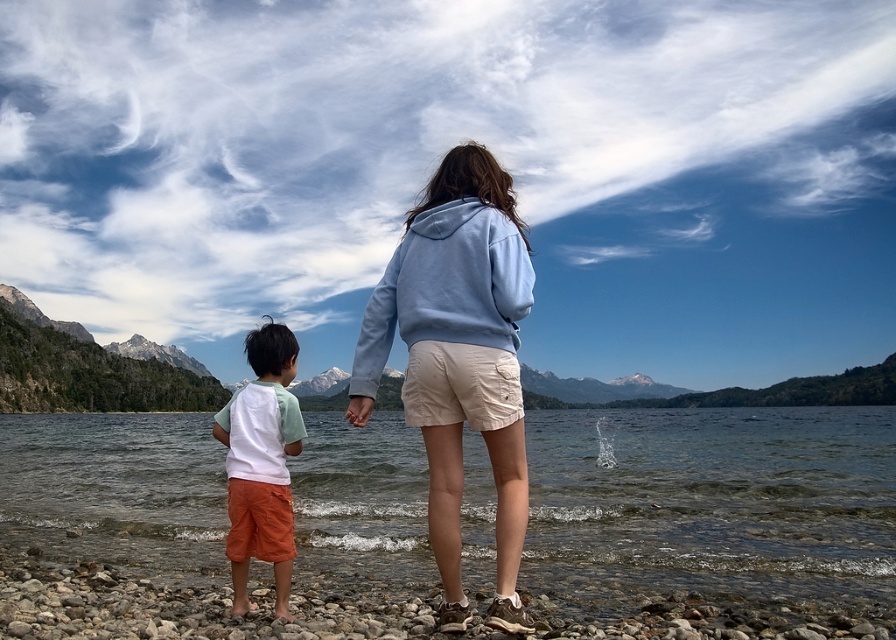
You are a photographer trying to capture a photo of both the light blue hoodie at center and the light blue fleece sweatshirt at center. Since they are both at the center, which one should you focus on first to ensure both are in frame?

The light blue hoodie at center is positioned on the right side of light blue fleece sweatshirt at center, so you should focus on the light blue fleece sweatshirt at center first to ensure both are in frame.

You are standing at the lakeside and want to reach the point marked as point (653,524). Given that your walking speed is 1.5 meters per second, how long will it take you to reach there?

The point (653,524) is 39.13 meters away from the viewer. At a walking speed of 1.5 meters per second, it would take approximately 26.09 seconds to reach there.